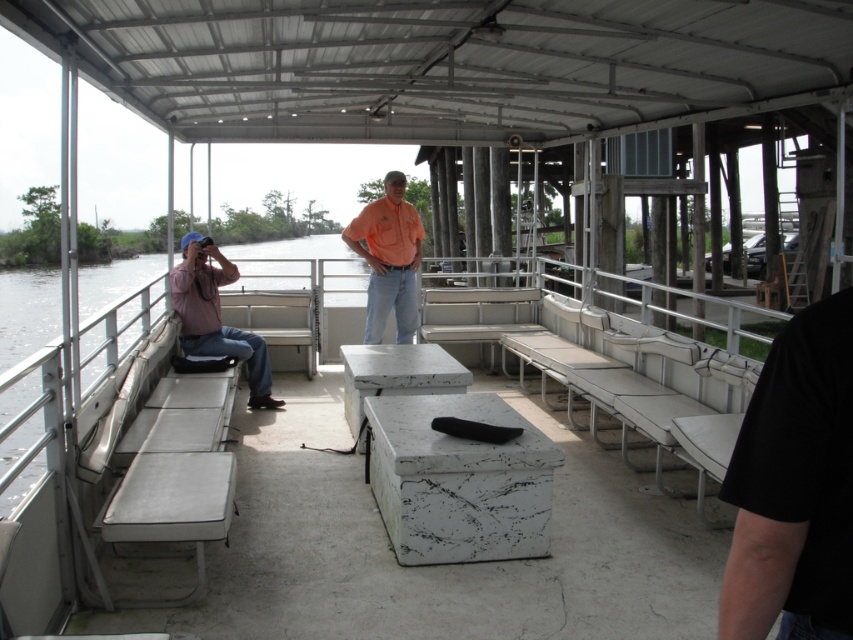
Between orange cotton shirt at center and white marble picnic table at center, which one has more height?

orange cotton shirt at center

Which is in front, point (379, 336) or point (421, 387)?

Point (421, 387) is in front.

Find the location of a particular element. This screenshot has height=640, width=853. orange cotton shirt at center is located at coordinates (387, 259).

This screenshot has height=640, width=853. I want to click on orange cotton shirt at center, so click(387, 259).

Does orange cotton shirt at center appear under matte pink shirt at left?

Incorrect, orange cotton shirt at center is not positioned below matte pink shirt at left.

Locate an element on the screen. orange cotton shirt at center is located at coordinates (387, 259).

You are a GUI agent. You are given a task and a screenshot of the screen. Output one action in this format:
    pyautogui.click(x=<x>, y=<y>)
    Task: Click on the orange cotton shirt at center
    Image resolution: width=853 pixels, height=640 pixels.
    Given the screenshot: What is the action you would take?
    pyautogui.click(x=387, y=259)

Based on the photo, can you confirm if matte pink shirt at left is positioned to the left of white fabric bench at center?

Correct, you'll find matte pink shirt at left to the left of white fabric bench at center.

Can you confirm if matte pink shirt at left is shorter than white fabric bench at center?

In fact, matte pink shirt at left may be taller than white fabric bench at center.

Is point (229, 260) farther from viewer compared to point (289, 324)?

No, (229, 260) is in front of (289, 324).

Find the location of a particular element. This screenshot has height=640, width=853. matte pink shirt at left is located at coordinates (215, 316).